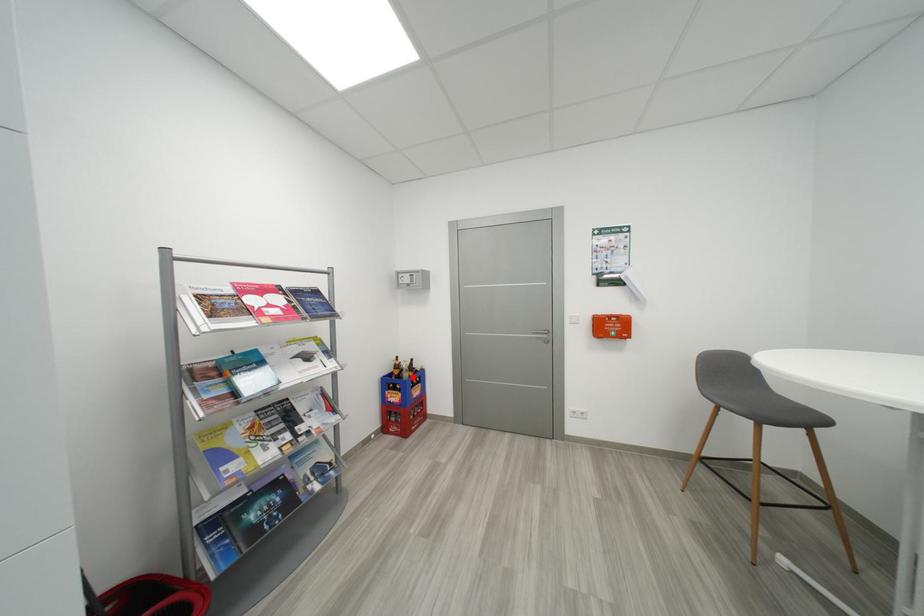
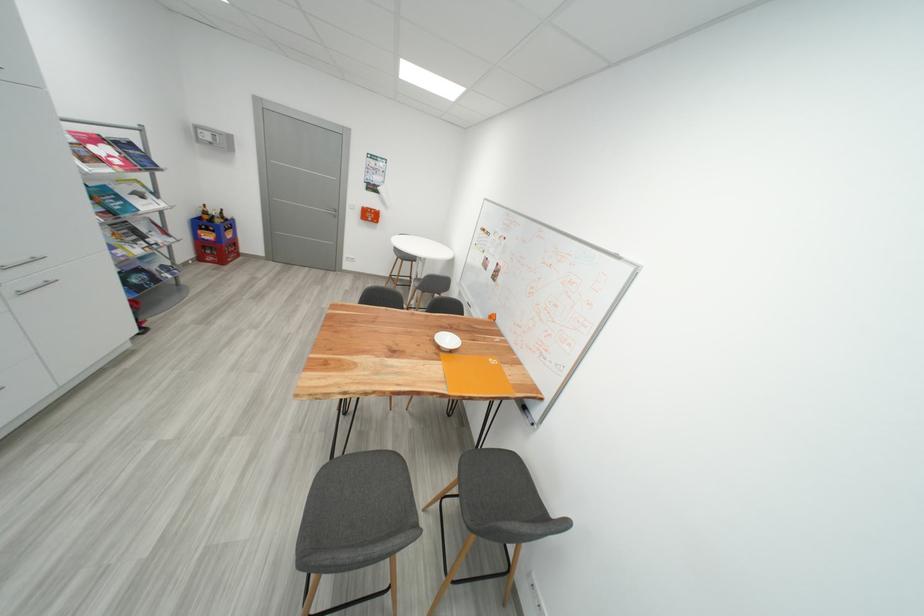
Question: I am providing you with two images of the same scene from different viewpoints. A red point is shown in image1. For the corresponding object point in image2, is it positioned nearer or farther from the camera?

Choices:
 (A) Nearer
 (B) Farther

Answer: (A)